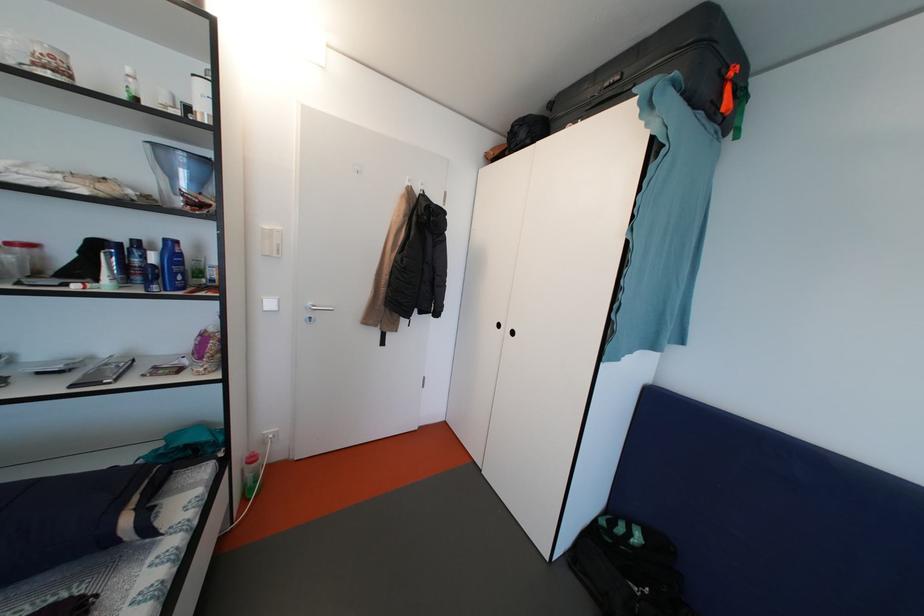
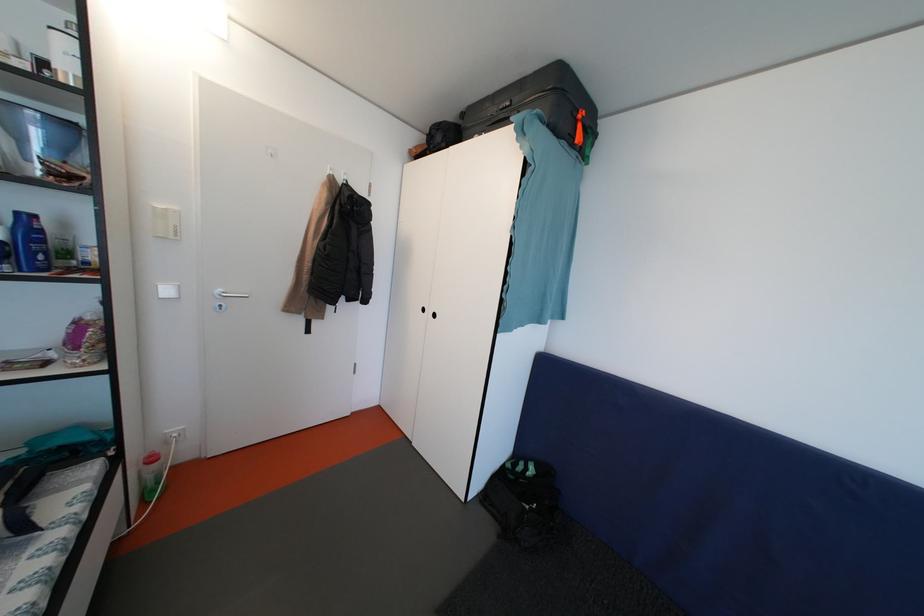
Find the pixel in the second image that matches (505,331) in the first image.

(431, 315)